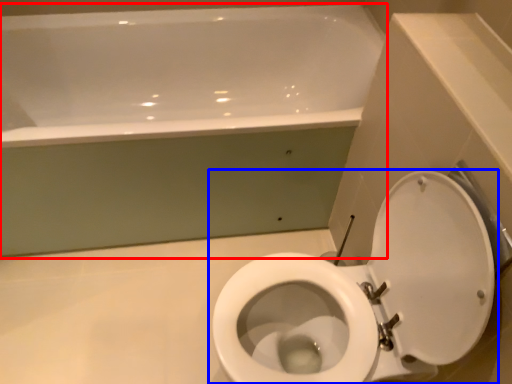
Question: Among these objects, which one is farthest to the camera, bathtub (highlighted by a red box) or toilet (highlighted by a blue box)?

Choices:
 (A) bathtub
 (B) toilet

Answer: (A)